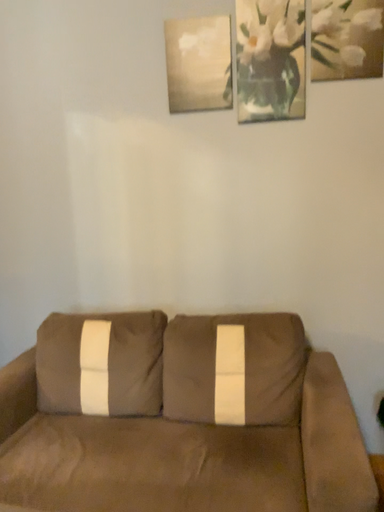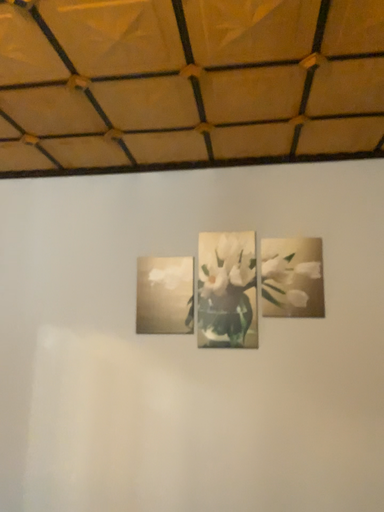
Question: How did the camera likely rotate when shooting the video?

Choices:
 (A) rotated downward
 (B) rotated upward

Answer: (B)